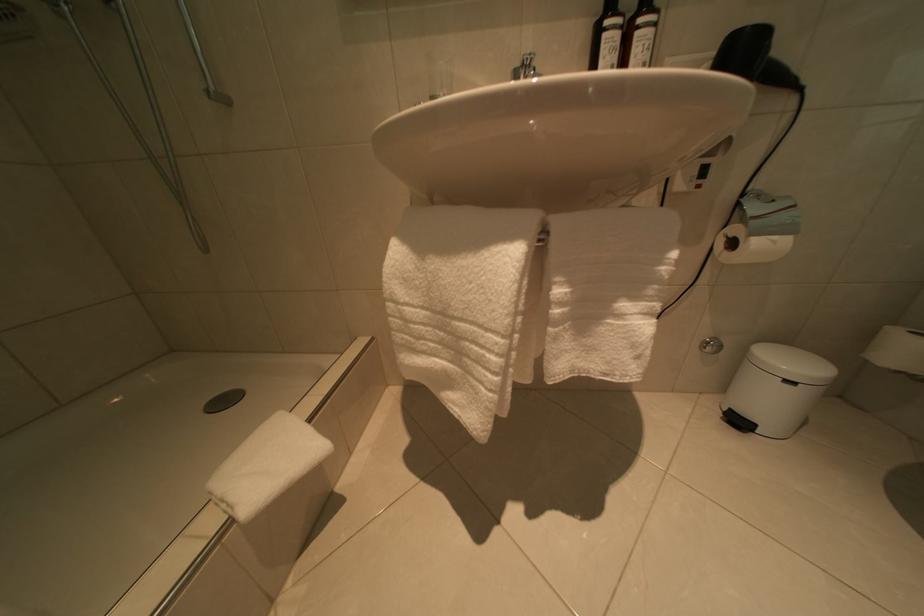
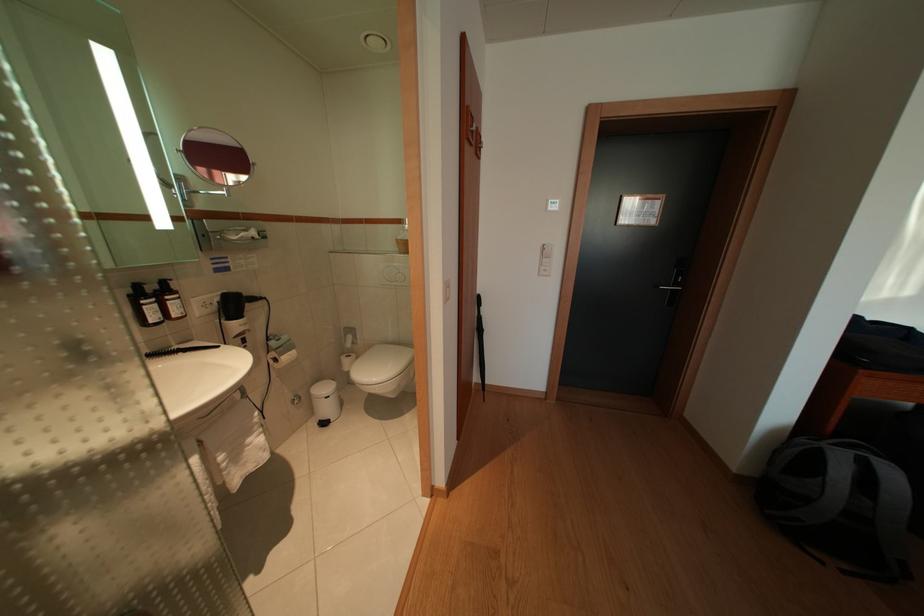
Where in the second image is the point corresponding to (774,408) from the first image?

(335, 415)